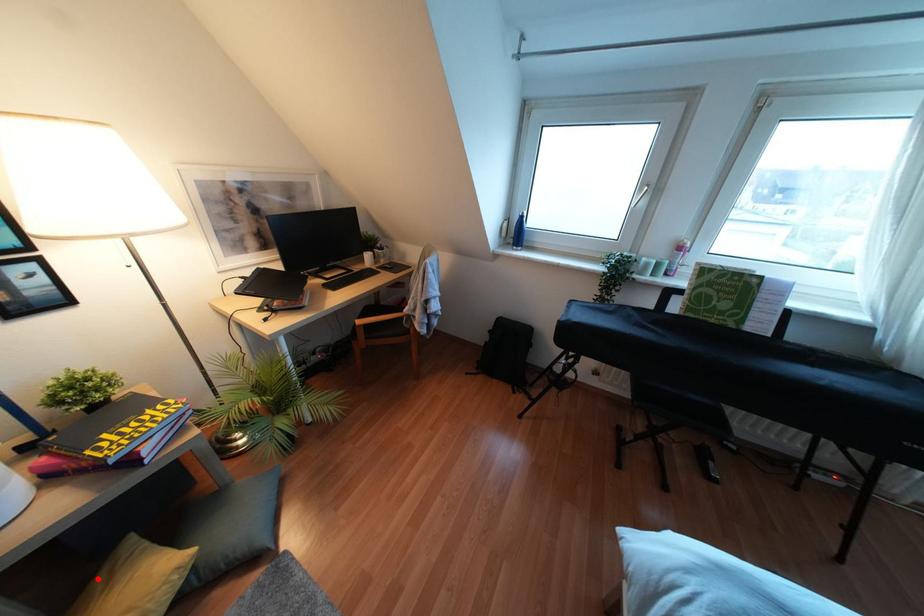
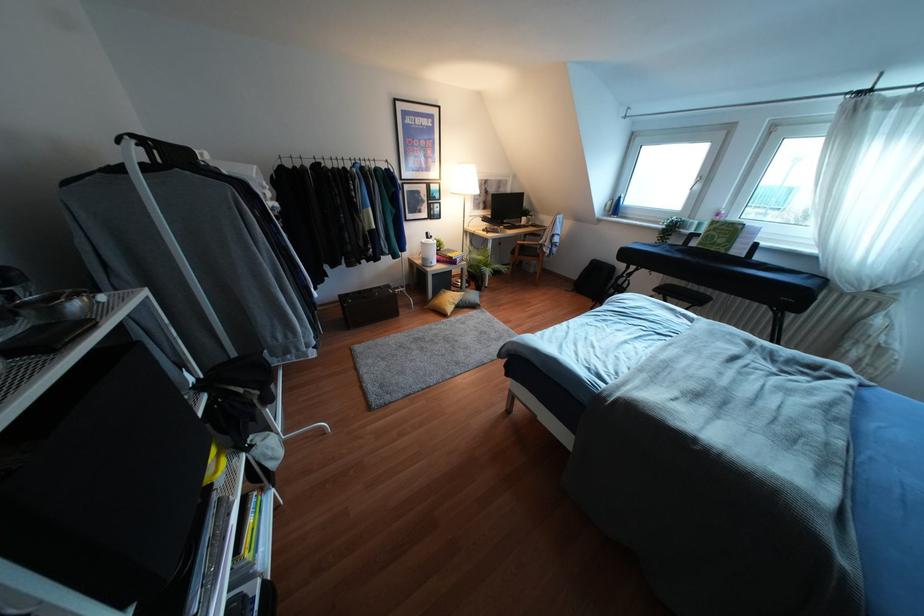
Question: I am providing you with two images of the same scene from different viewpoints. A red point is shown in image1. For the corresponding object point in image2, is it positioned nearer or farther from the camera?

Choices:
 (A) Nearer
 (B) Farther

Answer: (B)